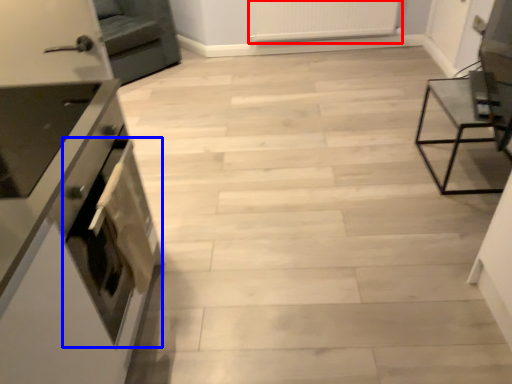
Question: Among these objects, which one is farthest to the camera, radiator (highlighted by a red box) or oven (highlighted by a blue box)?

Choices:
 (A) radiator
 (B) oven

Answer: (A)